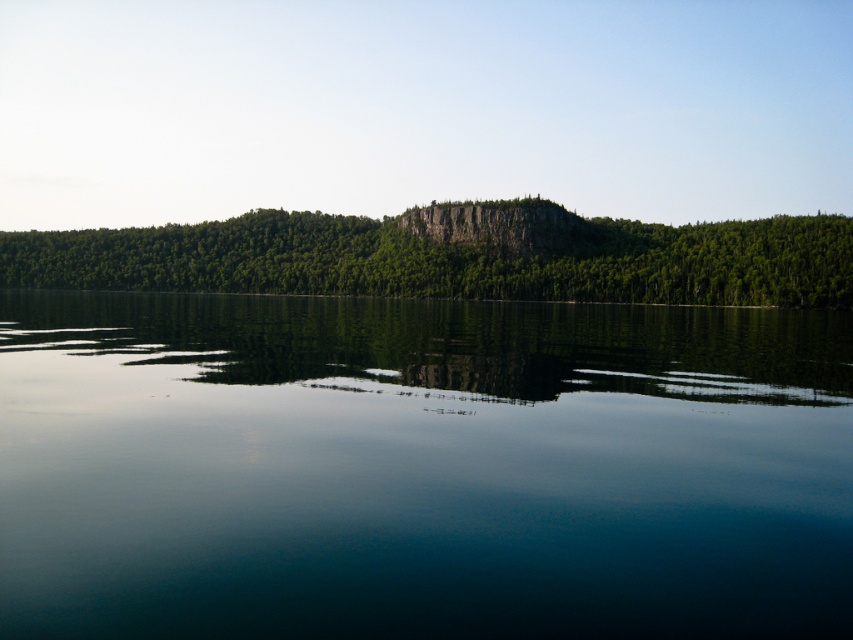
Which is in front, point (546, 561) or point (548, 205)?

Positioned in front is point (546, 561).

Locate an element on the screen. transparent glass water at center is located at coordinates (421, 468).

Between transparent glass water at center and rocky cliff at center, which one is positioned lower?

Positioned lower is transparent glass water at center.

Does transparent glass water at center appear under rocky cliff at center?

Yes.

I want to click on transparent glass water at center, so click(421, 468).

The image size is (853, 640). I want to click on transparent glass water at center, so tap(421, 468).

Who is more distant from viewer, (582, 252) or (547, 209)?

Positioned behind is point (547, 209).

Based on the photo, who is more forward, (492, 205) or (421, 221)?

Point (492, 205) is in front.

Find the location of a particular element. The image size is (853, 640). green leafy trees at center is located at coordinates (456, 257).